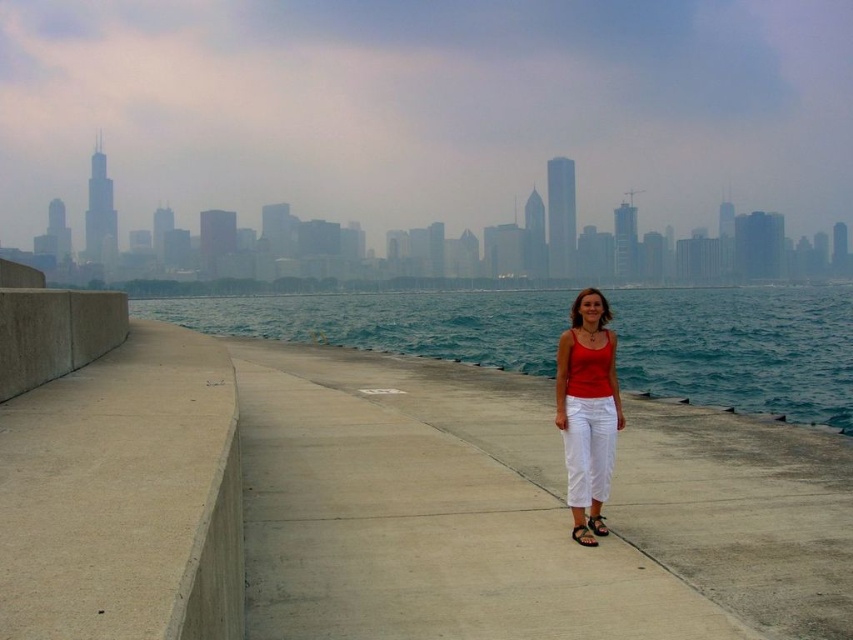
You are a photographer trying to capture the woman in the scene. You notice the matte red tank top at center and the black leather sandal at center. Which item is positioned higher on her body?

The matte red tank top at center is above the black leather sandal at center, so the matte red tank top at center is positioned higher on her body.